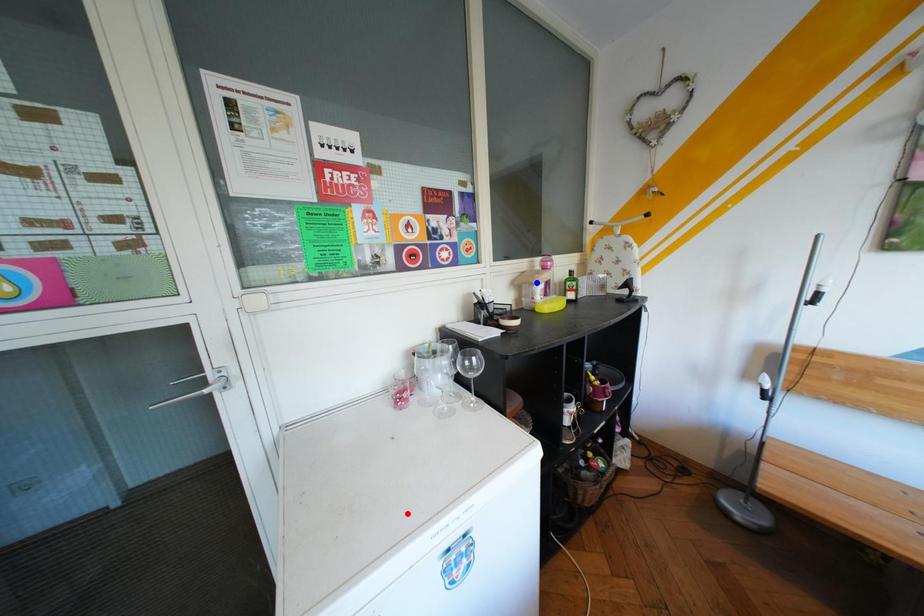
Question: Which of the two points in the image is closer to the camera?

Choices:
 (A) Blue point is closer.
 (B) Red point is closer.

Answer: (B)